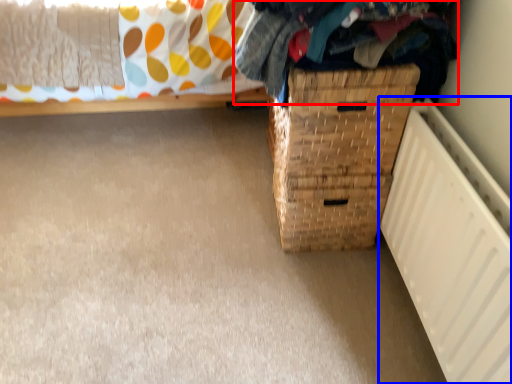
Question: Which object appears farthest to the camera in this image, clothing (highlighted by a red box) or radiator (highlighted by a blue box)?

Choices:
 (A) clothing
 (B) radiator

Answer: (A)